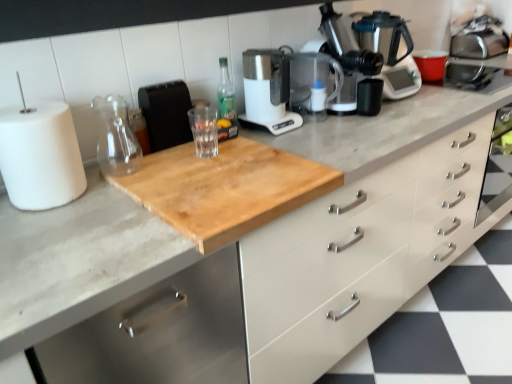
You are a GUI agent. You are given a task and a screenshot of the screen. Output one action in this format:
    pyautogui.click(x=<x>, y=<y>)
    Task: Click on the free spot to the right of black matte cup at center, which is counted as the 3th appliance, starting from the left
    The width and height of the screenshot is (512, 384).
    Given the screenshot: What is the action you would take?
    pyautogui.click(x=412, y=109)